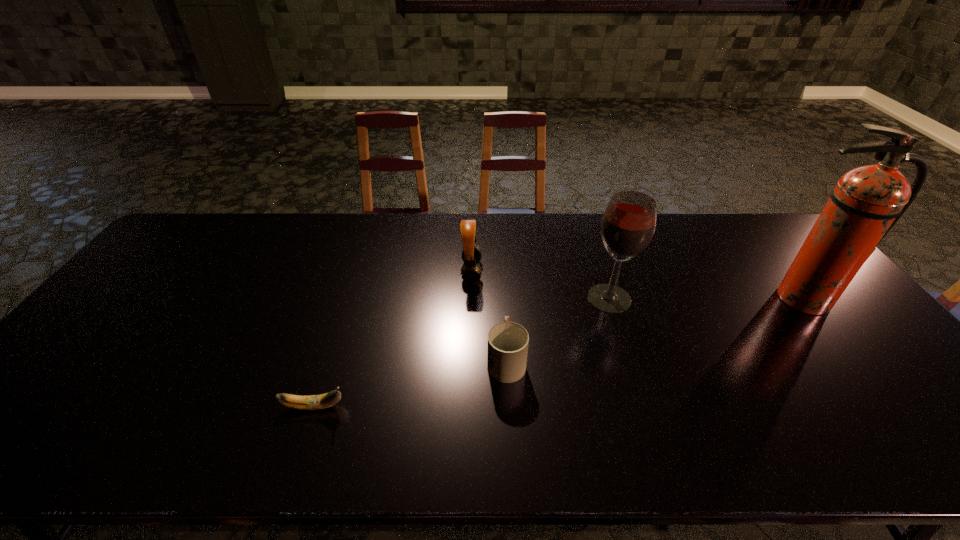
The height and width of the screenshot is (540, 960). I want to click on vacant region that satisfies the following two spatial constraints: 1. on the ear cups of the fourth object from right to left; 2. on the side of the third object from left to right where the handle is located, so click(x=469, y=360).

Find the location of `vacant space that satisfies the following two spatial constraints: 1. on the ear cups of the fourth object from left to right; 2. on the left side of the second object from left to right`. vacant space that satisfies the following two spatial constraints: 1. on the ear cups of the fourth object from left to right; 2. on the left side of the second object from left to right is located at coordinates (471, 299).

I want to click on vacant space that satisfies the following two spatial constraints: 1. on the side of the cup where the handle is located; 2. on the right side of the fourth shortest object, so click(503, 299).

At what (x,y) coordinates should I click in order to perform the action: click on free point that satisfies the following two spatial constraints: 1. on the ear cups of the second object from left to right; 2. on the side of the cup where the handle is located. Please return your answer as a coordinate pair (x, y). Image resolution: width=960 pixels, height=540 pixels. Looking at the image, I should click on (469, 360).

Find the location of a particular element. The width and height of the screenshot is (960, 540). vacant space that satisfies the following two spatial constraints: 1. at the nozzle of the tallest object; 2. at the stem of the shortest object is located at coordinates (886, 407).

Locate an element on the screen. This screenshot has height=540, width=960. free space that satisfies the following two spatial constraints: 1. on the side of the second nearest object where the handle is located; 2. on the right side of the alcohol is located at coordinates click(x=503, y=299).